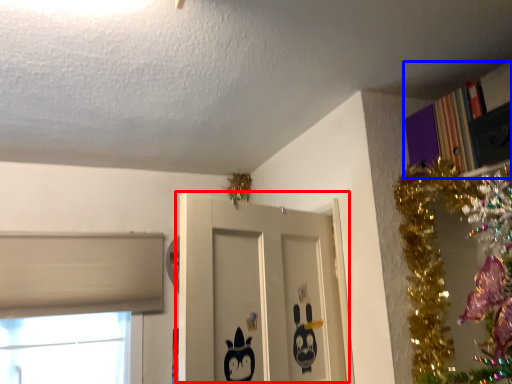
Question: Among these objects, which one is nearest to the camera, door (highlighted by a red box) or bookcase (highlighted by a blue box)?

Choices:
 (A) door
 (B) bookcase

Answer: (A)